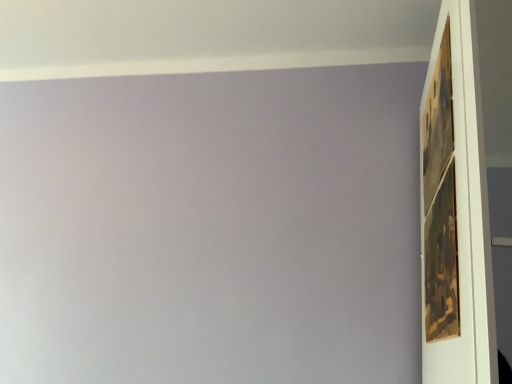
This screenshot has width=512, height=384. Describe the element at coordinates (440, 202) in the screenshot. I see `wooden picture frame at upper right` at that location.

Locate an element on the screen. wooden picture frame at upper right is located at coordinates (440, 202).

This screenshot has width=512, height=384. Identify the location of wooden picture frame at upper right. (440, 202).